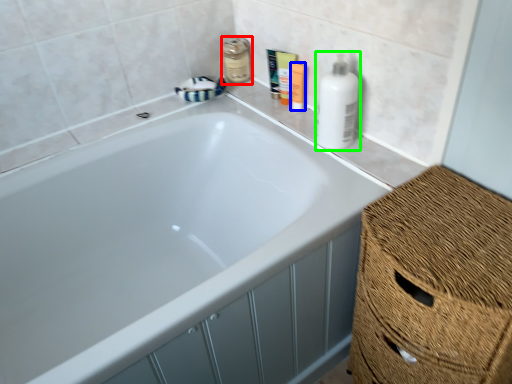
Question: Which object is the closest to the mouthwash (highlighted by a red box)? Choose among these: toiletry (highlighted by a blue box) or cleaning product (highlighted by a green box).

Choices:
 (A) toiletry
 (B) cleaning product

Answer: (A)